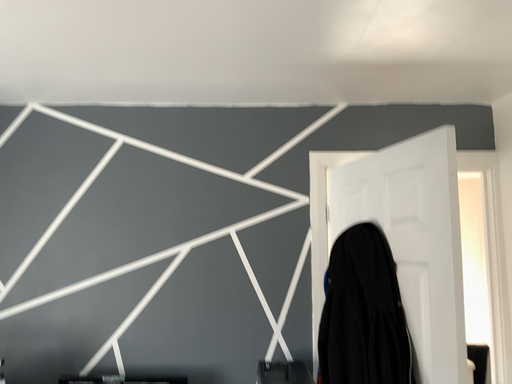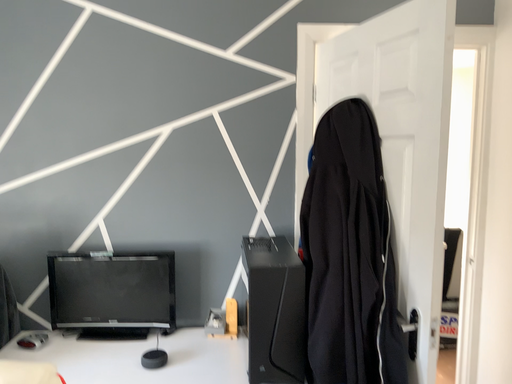
Question: How did the camera likely rotate when shooting the video?

Choices:
 (A) rotated upward
 (B) rotated downward

Answer: (B)